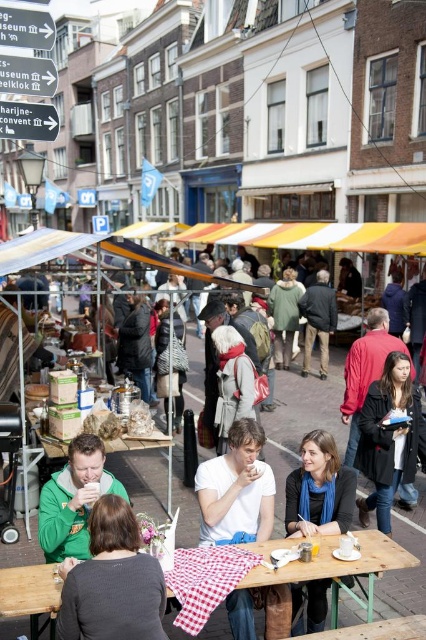
You are a customer at the market and want to sit down. You see a wooden picnic table at center and a green matte jacket at lower left. Which object is shorter and thus more suitable for sitting?

The wooden picnic table at center is shorter than the green matte jacket at lower left, so it is more suitable for sitting.

You are a customer at this market and want to buy both the white cotton shirt at center and the green matte jacket at lower left. You need to walk from the entrance, which is at the far end of the street opposite the stalls, to collect both items. Which item should you pick up first to minimize backtracking?

You should pick up the green matte jacket at lower left first because it is located to the left of the white cotton shirt at center, so starting from the entrance at the far end, you can collect the green matte jacket at lower left first and then proceed to the white cotton shirt at center without needing to backtrack.